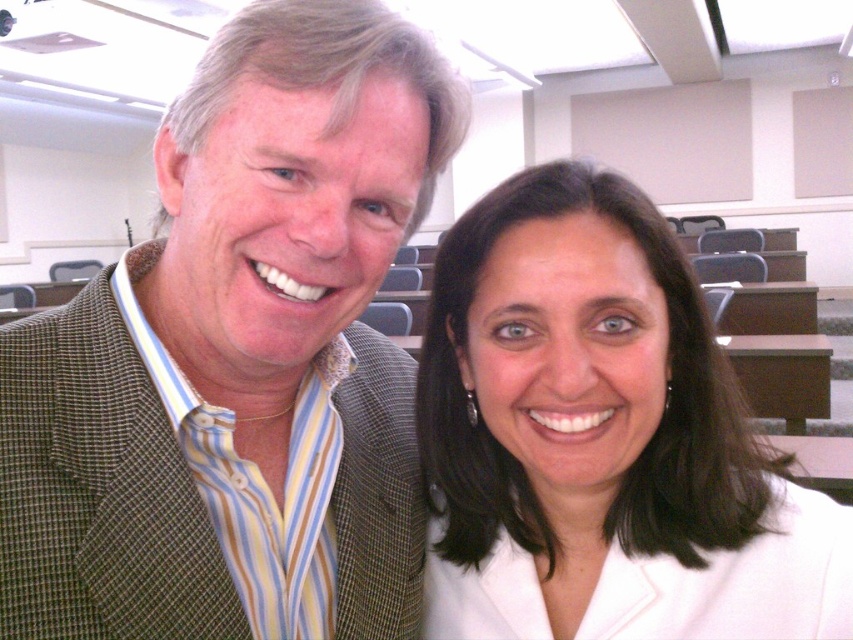
Can you confirm if green plaid blazer at left is positioned to the right of white glossy blazer at center?

Incorrect, green plaid blazer at left is not on the right side of white glossy blazer at center.

Who is higher up, green plaid blazer at left or white glossy blazer at center?

green plaid blazer at left is above.

Between point (108, 320) and point (561, 168), which one is positioned behind?

The point (108, 320) is behind.

Locate an element on the screen. This screenshot has height=640, width=853. green plaid blazer at left is located at coordinates (305, 264).